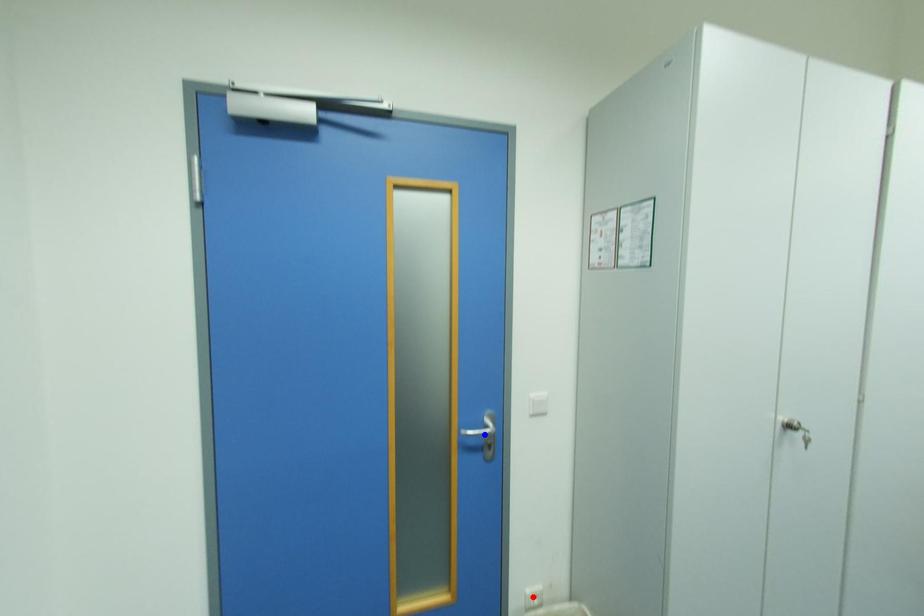
Question: In the image, two points are highlighted. Which point is nearer to the camera? Reply with the corresponding letter.

Choices:
 (A) blue point
 (B) red point

Answer: (A)